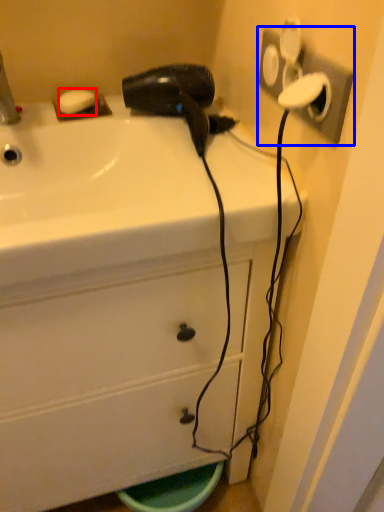
Question: Which object is closer to the camera taking this photo, soap (highlighted by a red box) or electric outlet (highlighted by a blue box)?

Choices:
 (A) soap
 (B) electric outlet

Answer: (B)